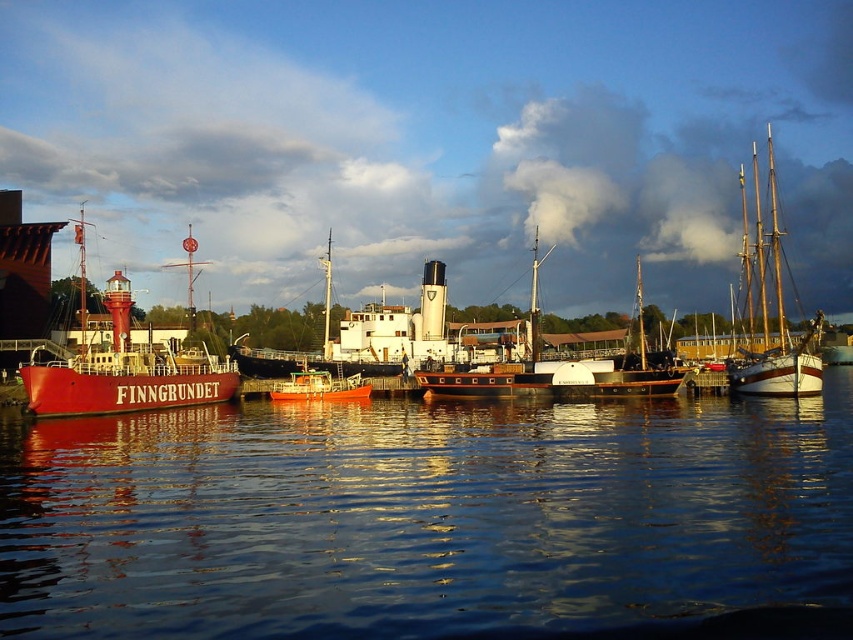
Can you confirm if transparent water at center is taller than matte red ship at left?

No.

Between point (349, 481) and point (106, 362), which one is positioned behind?

Point (106, 362)

Is point (57, 429) more distant than point (202, 365)?

No, it is in front of (202, 365).

Image resolution: width=853 pixels, height=640 pixels. Identify the location of transparent water at center. (421, 515).

Based on the photo, does matte red ship at left appear under wooden sailboat at right?

Correct, matte red ship at left is located below wooden sailboat at right.

Which is behind, point (196, 371) or point (792, 371)?

Point (196, 371)

Does point (216, 355) lie in front of point (775, 243)?

No, (216, 355) is further to viewer.

In order to click on matte red ship at left in this screenshot , I will do `click(125, 371)`.

Which is above, matte red ship at left or metallic orange boat at center?

Positioned higher is matte red ship at left.

Between point (113, 304) and point (302, 388), which one is positioned in front?

Point (113, 304) is in front.

Does point (51, 381) come behind point (352, 394)?

That is False.

Where is `matte red ship at left`? matte red ship at left is located at coordinates (125, 371).